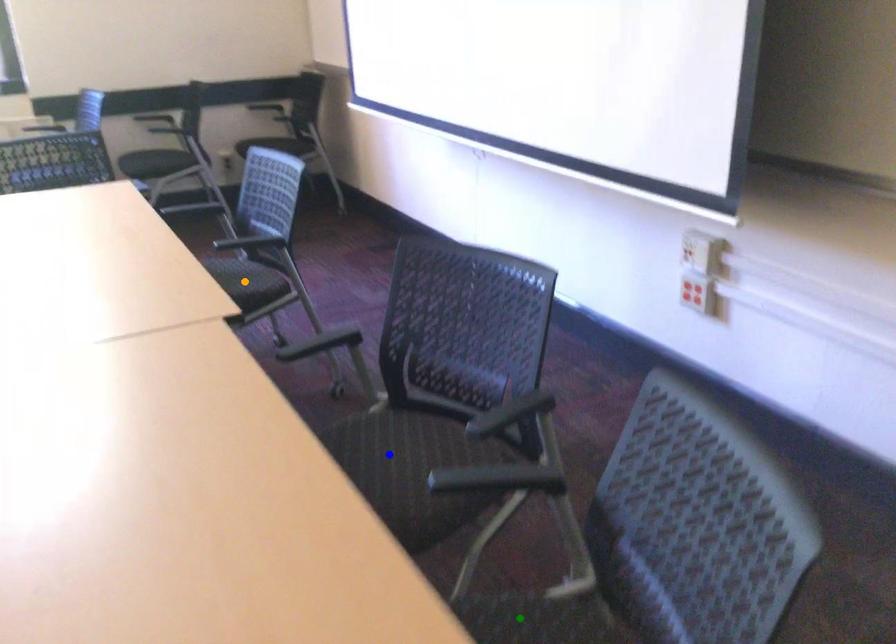
Order these from nearest to farthest:
A) green point
B) blue point
C) orange point

green point < blue point < orange point